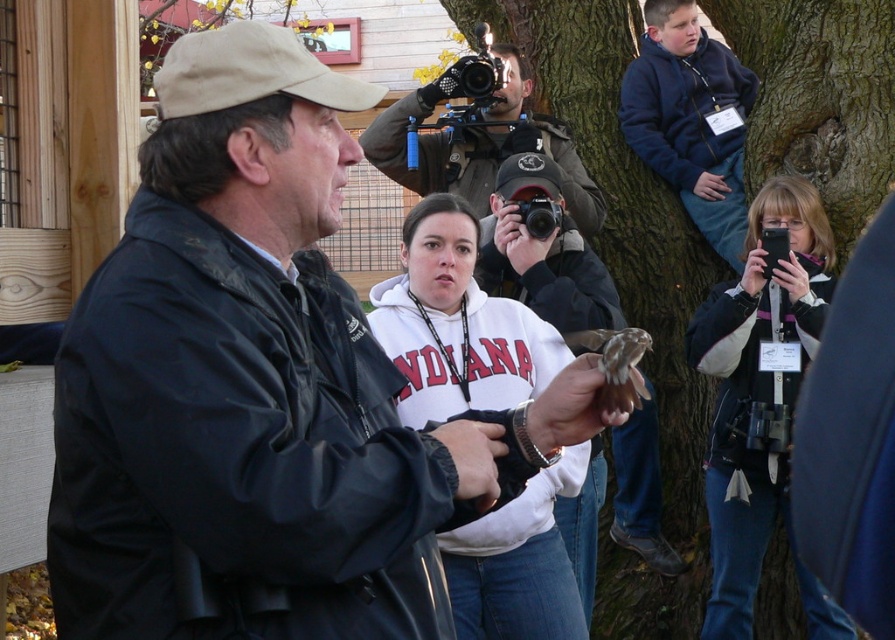
Question: Is white fleece sweatshirt at center positioned in front of matte black jacket at upper right?

Choices:
 (A) yes
 (B) no

Answer: (A)

Question: Which of the following is the closest to the observer?

Choices:
 (A) matte black jacket at upper right
 (B) matte brown jacket at center

Answer: (A)

Question: Does white fleece sweatshirt at center appear on the right side of matte brown jacket at center?

Choices:
 (A) yes
 (B) no

Answer: (B)

Question: Is matte black jacket at upper right thinner than matte brown jacket at center?

Choices:
 (A) no
 (B) yes

Answer: (B)

Question: Which point appears farthest from the camera in this image?

Choices:
 (A) (732, 572)
 (B) (461, 195)
 (C) (467, 216)

Answer: (B)

Question: Which point is farther from the camera taking this photo?

Choices:
 (A) (467, 86)
 (B) (815, 330)
 (C) (538, 348)

Answer: (A)